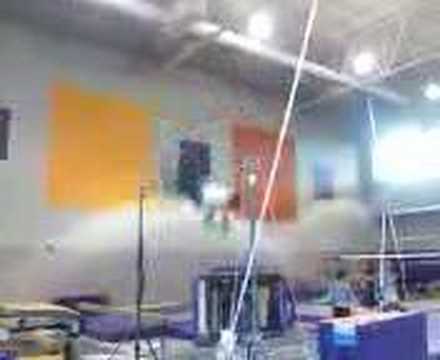
Where is `floor matts`? floor matts is located at coordinates (107, 325), (180, 325), (47, 317), (50, 310), (47, 345), (317, 311).